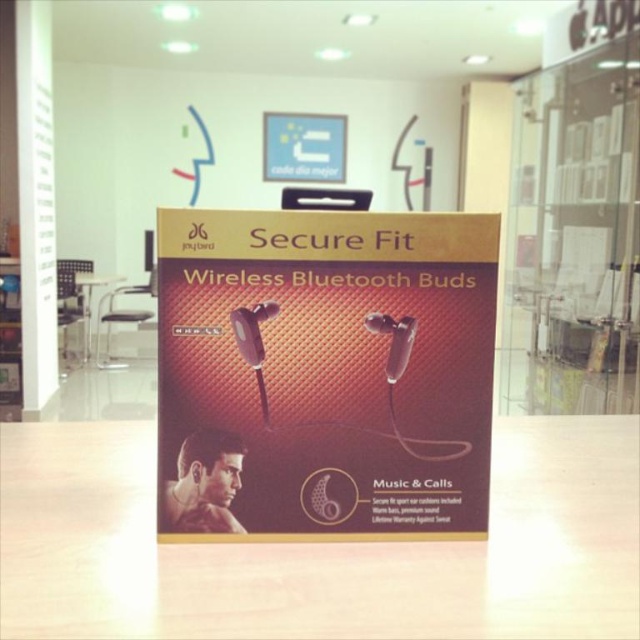
Question: Is wooden table at center to the left of white glossy table at center from the viewer's perspective?

Choices:
 (A) yes
 (B) no

Answer: (B)

Question: Which point is farther from the camera taking this photo?

Choices:
 (A) (372, 582)
 (B) (90, 285)
 (C) (401, 355)
 (D) (148, 269)

Answer: (B)

Question: Can you confirm if wooden table at center is wider than white glossy table at center?

Choices:
 (A) yes
 (B) no

Answer: (A)

Question: Which point appears closest to the camera in this image?

Choices:
 (A) (253, 316)
 (B) (390, 356)
 (C) (209, 577)
 (D) (83, 301)

Answer: (C)

Question: Estimate the real-world distances between objects in this image. Which object is farther from the matte black speaker at center?

Choices:
 (A) white glossy table at center
 (B) clear plastic microphone at center
 (C) wooden table at center
 (D) satin silver microphone at center

Answer: (B)

Question: Is wooden table at center below matte black speaker at center?

Choices:
 (A) yes
 (B) no

Answer: (A)